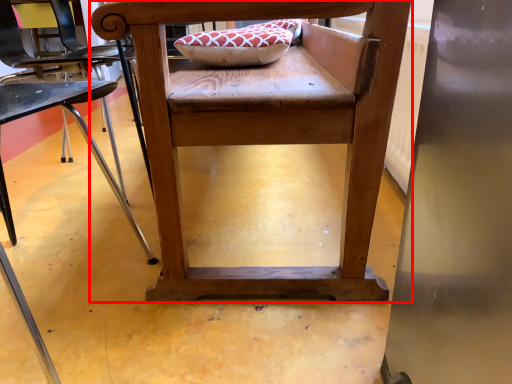
Question: From the image's perspective, where is chair (annotated by the red box) located in relation to chair in the image?

Choices:
 (A) below
 (B) above

Answer: (B)